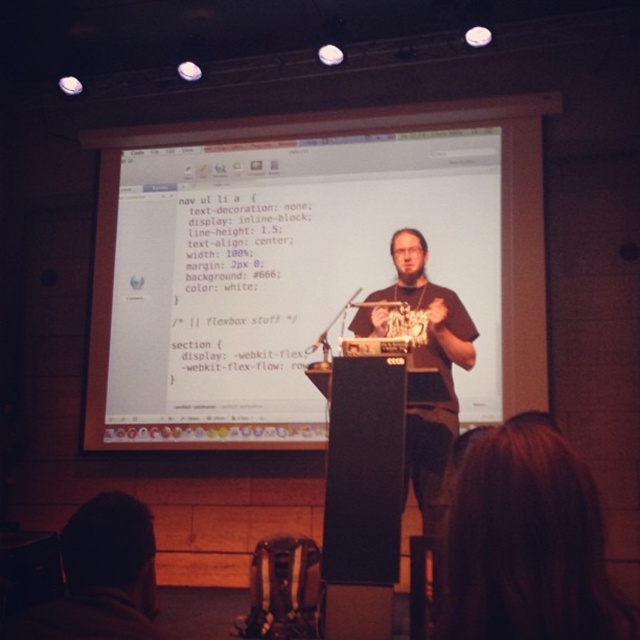
Question: Does white matte screen at center appear under brown matte t-shirt at center?

Choices:
 (A) yes
 (B) no

Answer: (B)

Question: In this image, where is white matte screen at center located relative to brown matte t-shirt at center?

Choices:
 (A) above
 (B) below

Answer: (A)

Question: Which of these objects is positioned closest to the white matte screen at center?

Choices:
 (A) black matte podium at center
 (B) brown matte t-shirt at center

Answer: (B)

Question: Which object is the farthest from the brown matte t-shirt at center?

Choices:
 (A) dark brown hair at lower left
 (B) brown hair at upper center
 (C) black matte podium at center
 (D) white matte screen at center

Answer: (A)

Question: Is brown hair at upper center behind brown matte t-shirt at center?

Choices:
 (A) yes
 (B) no

Answer: (B)

Question: Which object is the closest to the dark brown hair at lower left?

Choices:
 (A) black matte podium at center
 (B) brown hair at upper center

Answer: (B)